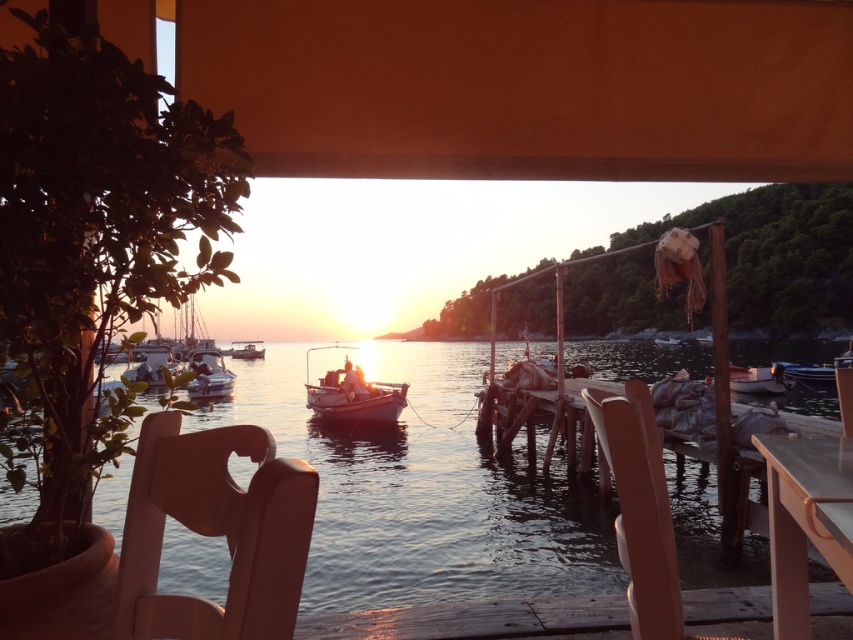
Question: Which of these objects is positioned farthest from the matte white boat at center?

Choices:
 (A) orange fabric canopy at upper center
 (B) wooden boat at center

Answer: (A)

Question: Which object is the closest to the matte plastic chair at lower right?

Choices:
 (A) matte plastic chair at lower left
 (B) white wooden boat at center

Answer: (A)

Question: Which object appears farthest from the camera in this image?

Choices:
 (A) metallic silver boat at left
 (B) white wooden boat at center
 (C) translucent water at center

Answer: (B)

Question: Is wooden dock at lower center bigger than light brown wooden table at lower right?

Choices:
 (A) yes
 (B) no

Answer: (B)

Question: Observing the image, what is the correct spatial positioning of matte plastic chair at lower right in reference to wooden boat at center?

Choices:
 (A) right
 (B) left

Answer: (A)

Question: In this image, where is matte plastic chair at lower left located relative to smooth wooden boat at center?

Choices:
 (A) left
 (B) right

Answer: (B)